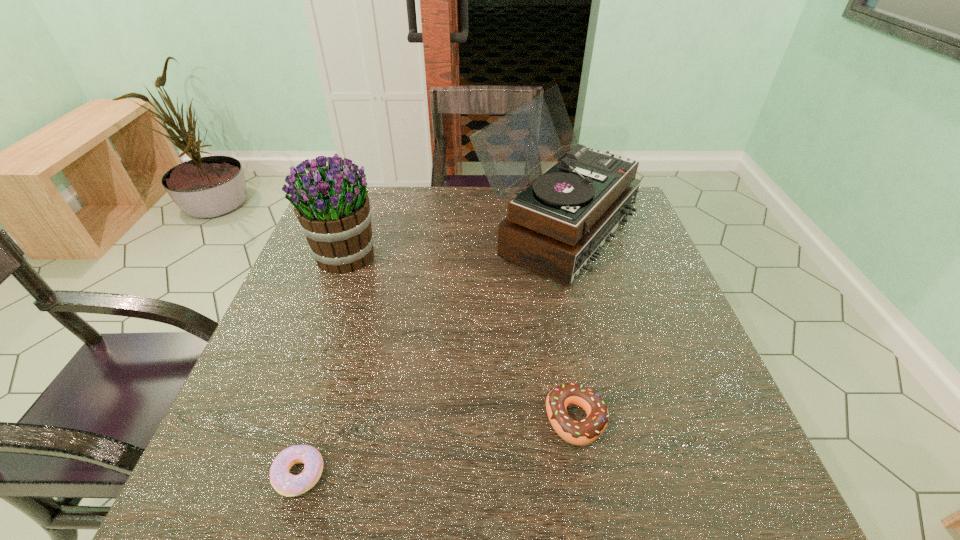
This screenshot has height=540, width=960. I want to click on record player, so click(x=557, y=225).

Locate an element on the screen. Image resolution: width=960 pixels, height=540 pixels. the second tallest object is located at coordinates (331, 204).

Locate an element on the screen. This screenshot has height=540, width=960. the farther doughnut is located at coordinates (584, 432).

Locate an element on the screen. The image size is (960, 540). the taller doughnut is located at coordinates (584, 432).

Where is `the nearer doughnut`? the nearer doughnut is located at coordinates (286, 484).

This screenshot has width=960, height=540. I want to click on the left doughnut, so click(x=286, y=484).

Locate an element on the screen. vacant space located 0.350m on the front of the record player is located at coordinates (597, 422).

Identify the location of vacant space located on the front of the bouquet. The image size is (960, 540). (329, 302).

I want to click on vacant space located on the back of the second shortest object, so click(x=550, y=273).

This screenshot has height=540, width=960. Find the location of `free space located on the back of the left doughnut`. free space located on the back of the left doughnut is located at coordinates (334, 359).